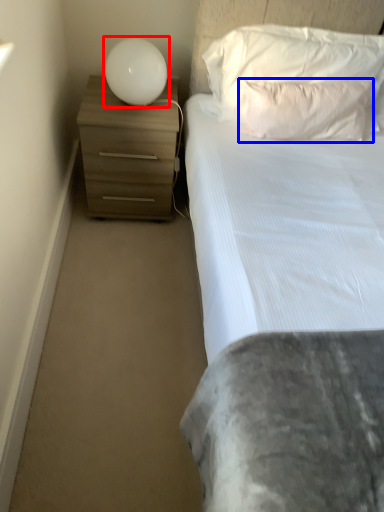
Question: Which point is closer to the camera, lamp (highlighted by a red box) or pillow (highlighted by a blue box)?

Choices:
 (A) lamp
 (B) pillow

Answer: (B)